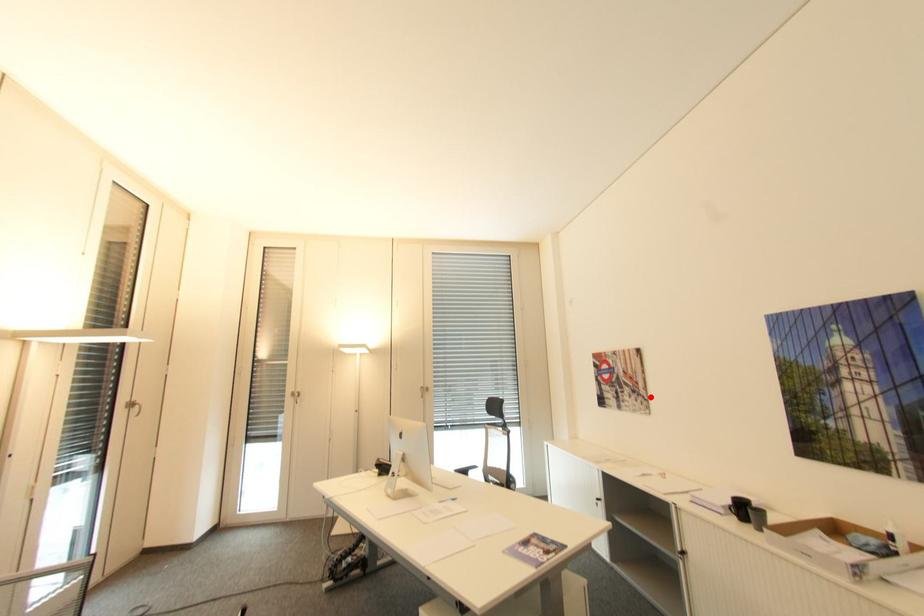
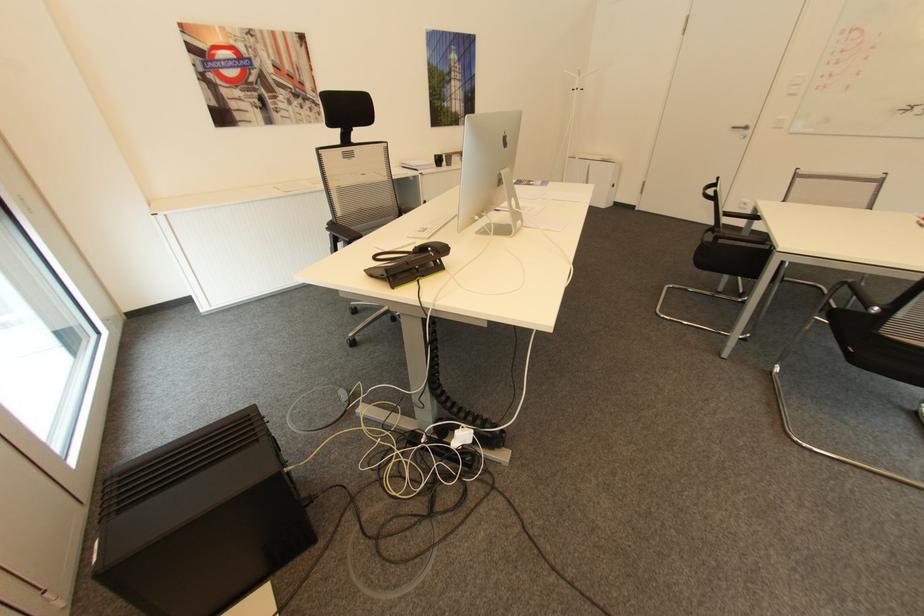
Question: A red point is marked in image1. In image2, is the corresponding 3D point closer to the camera or farther? Reply with the corresponding letter.

Choices:
 (A) The corresponding 3D point is closer.
 (B) The corresponding 3D point is farther.

Answer: (A)